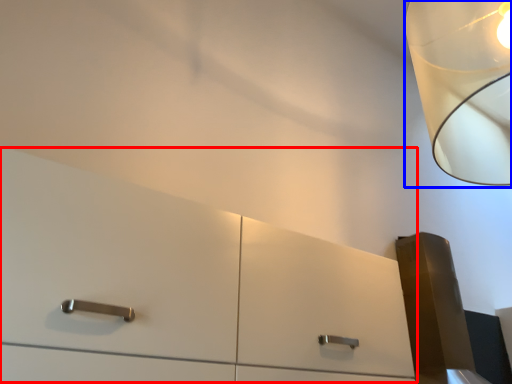
Question: Among these objects, which one is farthest to the camera, dresser (highlighted by a red box) or lamp (highlighted by a blue box)?

Choices:
 (A) dresser
 (B) lamp

Answer: (B)